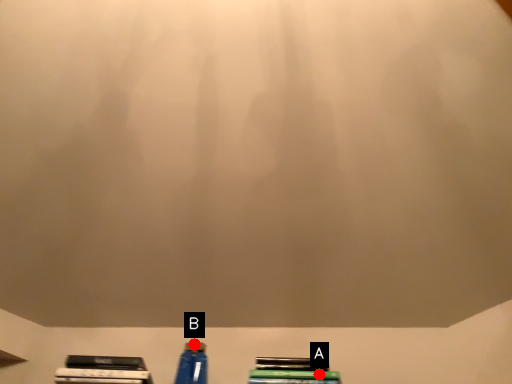
Question: Two points are circled on the image, labeled by A and B beside each circle. Which of the following is the closest to the observer?

Choices:
 (A) A is closer
 (B) B is closer

Answer: (A)